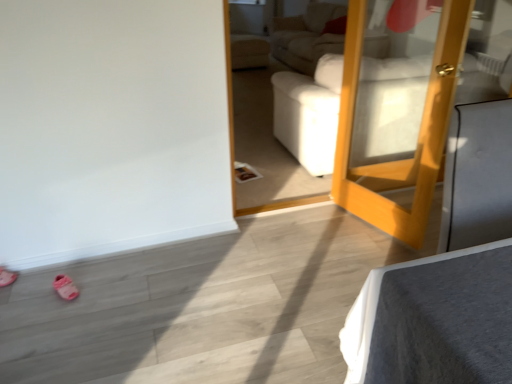
What do you see at coordinates (419, 138) in the screenshot? I see `wooden mirror at right` at bounding box center [419, 138].

The height and width of the screenshot is (384, 512). What are the coordinates of `pink rubber shoe at lower left, marked as the second shoe in a right-to-left arrangement` in the screenshot? It's located at (7, 277).

From the image's perspective, which one is positioned higher, pink fabric shoe at lower left, acting as the second shoe starting from the left, or wooden mirror at right?

wooden mirror at right is shown above in the image.

Can you confirm if pink fabric shoe at lower left, which ranks as the first shoe in right-to-left order, is taller than wooden mirror at right?

In fact, pink fabric shoe at lower left, which ranks as the first shoe in right-to-left order, may be shorter than wooden mirror at right.

There is a pink fabric shoe at lower left, which ranks as the first shoe in right-to-left order. Where is `door above it (from a real-world perspective)`? door above it (from a real-world perspective) is located at coordinates (419, 138).

Between pink fabric shoe at lower left, acting as the second shoe starting from the left, and wooden mirror at right, which one has larger width?

pink fabric shoe at lower left, acting as the second shoe starting from the left.

Considering the relative positions of wooden mirror at right and pink rubber shoe at lower left, marked as the second shoe in a right-to-left arrangement, in the image provided, is wooden mirror at right behind pink rubber shoe at lower left, marked as the second shoe in a right-to-left arrangement,?

No.

From a real-world perspective, who is located lower, wooden mirror at right or pink rubber shoe at lower left, arranged as the 1th shoe when viewed from the left?

In real-world perspective, pink rubber shoe at lower left, arranged as the 1th shoe when viewed from the left, is lower.

In terms of height, does wooden mirror at right look taller or shorter compared to pink rubber shoe at lower left, arranged as the 1th shoe when viewed from the left?

Considering their sizes, wooden mirror at right has more height than pink rubber shoe at lower left, arranged as the 1th shoe when viewed from the left.

Is point (386, 167) behind point (2, 284)?

Yes, it is behind point (2, 284).

Looking at this image, could wooden mirror at right be considered to be inside pink rubber shoe at lower left, marked as the second shoe in a right-to-left arrangement?

Definitely not — wooden mirror at right is not inside pink rubber shoe at lower left, marked as the second shoe in a right-to-left arrangement.

Which is behind, pink rubber shoe at lower left, arranged as the 1th shoe when viewed from the left, or wooden mirror at right?

Positioned behind is pink rubber shoe at lower left, arranged as the 1th shoe when viewed from the left.

Based on the photo, from the image's perspective, is pink rubber shoe at lower left, arranged as the 1th shoe when viewed from the left, beneath wooden mirror at right?

Indeed, from the image's perspective, pink rubber shoe at lower left, arranged as the 1th shoe when viewed from the left, is shown beneath wooden mirror at right.

There is a pink rubber shoe at lower left, marked as the second shoe in a right-to-left arrangement. Where is `shoe above it (from a real-world perspective)`? The width and height of the screenshot is (512, 384). shoe above it (from a real-world perspective) is located at coordinates (65, 287).

From the image's perspective, is pink fabric shoe at lower left, which ranks as the first shoe in right-to-left order, located above or below pink rubber shoe at lower left, marked as the second shoe in a right-to-left arrangement?

Clearly, from the image's perspective, pink fabric shoe at lower left, which ranks as the first shoe in right-to-left order, is below pink rubber shoe at lower left, marked as the second shoe in a right-to-left arrangement.

Is pink fabric shoe at lower left, acting as the second shoe starting from the left, positioned far away from pink rubber shoe at lower left, arranged as the 1th shoe when viewed from the left?

They are positioned close to each other.

Which is in front, pink fabric shoe at lower left, which ranks as the first shoe in right-to-left order, or pink rubber shoe at lower left, marked as the second shoe in a right-to-left arrangement?

pink fabric shoe at lower left, which ranks as the first shoe in right-to-left order, is more forward.

Is pink rubber shoe at lower left, arranged as the 1th shoe when viewed from the left, shorter than pink fabric shoe at lower left, which ranks as the first shoe in right-to-left order?

Indeed, pink rubber shoe at lower left, arranged as the 1th shoe when viewed from the left, has a lesser height compared to pink fabric shoe at lower left, which ranks as the first shoe in right-to-left order.

Looking at this image, is pink rubber shoe at lower left, marked as the second shoe in a right-to-left arrangement, oriented towards pink fabric shoe at lower left, which ranks as the first shoe in right-to-left order?

Yes, pink rubber shoe at lower left, marked as the second shoe in a right-to-left arrangement, is aimed at pink fabric shoe at lower left, which ranks as the first shoe in right-to-left order.

From the image's perspective, between pink rubber shoe at lower left, marked as the second shoe in a right-to-left arrangement, and pink fabric shoe at lower left, which ranks as the first shoe in right-to-left order, who is located below?

From the image's view, pink fabric shoe at lower left, which ranks as the first shoe in right-to-left order, is below.

Is pink rubber shoe at lower left, marked as the second shoe in a right-to-left arrangement, touching pink fabric shoe at lower left, which ranks as the first shoe in right-to-left order?

pink rubber shoe at lower left, marked as the second shoe in a right-to-left arrangement, and pink fabric shoe at lower left, which ranks as the first shoe in right-to-left order, are not in contact.

Is wooden mirror at right at the left side of pink fabric shoe at lower left, which ranks as the first shoe in right-to-left order?

Incorrect, wooden mirror at right is not on the left side of pink fabric shoe at lower left, which ranks as the first shoe in right-to-left order.

From a real-world perspective, is wooden mirror at right on top of pink fabric shoe at lower left, acting as the second shoe starting from the left?

Yes, from a real-world perspective, wooden mirror at right is above pink fabric shoe at lower left, acting as the second shoe starting from the left.

Consider the image. Can you confirm if wooden mirror at right is smaller than pink fabric shoe at lower left, acting as the second shoe starting from the left?

No, wooden mirror at right is not smaller than pink fabric shoe at lower left, acting as the second shoe starting from the left.

From the image's perspective, count 2nd shoes downward from the wooden mirror at right and point to it. Please provide its 2D coordinates.

[(65, 287)]

In the image, there is a pink fabric shoe at lower left, acting as the second shoe starting from the left. Identify the location of door above it (from the image's perspective). The height and width of the screenshot is (384, 512). (419, 138).

I want to click on door on the right of the pink rubber shoe at lower left, arranged as the 1th shoe when viewed from the left, so click(419, 138).

Looking at the image, which one is located closer to wooden mirror at right, pink rubber shoe at lower left, marked as the second shoe in a right-to-left arrangement, or pink fabric shoe at lower left, acting as the second shoe starting from the left?

pink fabric shoe at lower left, acting as the second shoe starting from the left, is closer to wooden mirror at right.

Looking at this image, which object lies nearer to the anchor point pink fabric shoe at lower left, acting as the second shoe starting from the left, wooden mirror at right or pink rubber shoe at lower left, marked as the second shoe in a right-to-left arrangement?

Based on the image, pink rubber shoe at lower left, marked as the second shoe in a right-to-left arrangement, appears to be nearer to pink fabric shoe at lower left, acting as the second shoe starting from the left.

From the picture: From the image, which object appears to be nearer to pink fabric shoe at lower left, which ranks as the first shoe in right-to-left order, pink rubber shoe at lower left, marked as the second shoe in a right-to-left arrangement, or wooden mirror at right?

Among the two, pink rubber shoe at lower left, marked as the second shoe in a right-to-left arrangement, is located nearer to pink fabric shoe at lower left, which ranks as the first shoe in right-to-left order.

Looking at the image, which one is located closer to wooden mirror at right, pink fabric shoe at lower left, which ranks as the first shoe in right-to-left order, or pink rubber shoe at lower left, marked as the second shoe in a right-to-left arrangement?

Among the two, pink fabric shoe at lower left, which ranks as the first shoe in right-to-left order, is located nearer to wooden mirror at right.

Looking at the image, which one is located closer to pink rubber shoe at lower left, marked as the second shoe in a right-to-left arrangement, pink fabric shoe at lower left, acting as the second shoe starting from the left, or wooden mirror at right?

pink fabric shoe at lower left, acting as the second shoe starting from the left.

Looking at the image, which one is located closer to pink rubber shoe at lower left, arranged as the 1th shoe when viewed from the left, wooden mirror at right or pink fabric shoe at lower left, which ranks as the first shoe in right-to-left order?

pink fabric shoe at lower left, which ranks as the first shoe in right-to-left order, is closer to pink rubber shoe at lower left, arranged as the 1th shoe when viewed from the left.

Where is `shoe between pink rubber shoe at lower left, arranged as the 1th shoe when viewed from the left, and wooden mirror at right`? shoe between pink rubber shoe at lower left, arranged as the 1th shoe when viewed from the left, and wooden mirror at right is located at coordinates (65, 287).